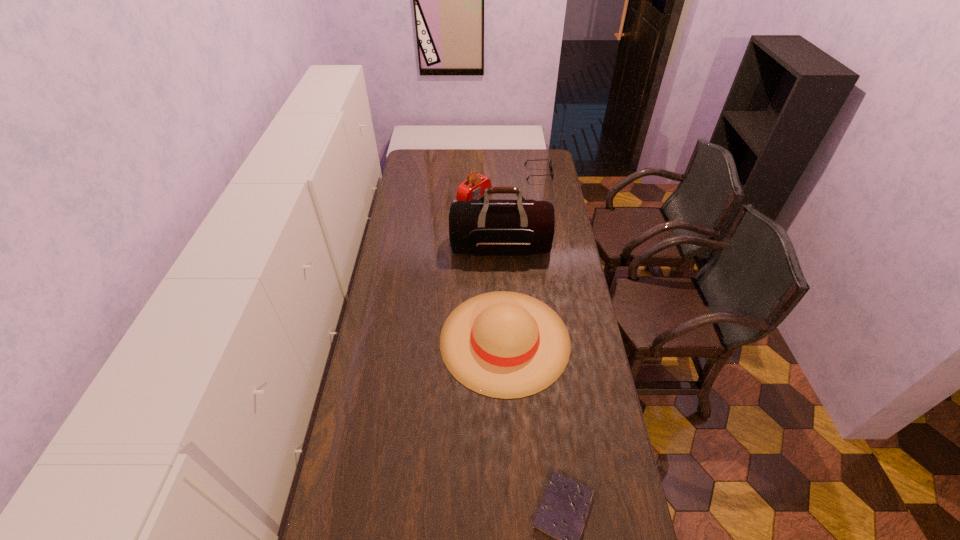
Identify the location of duffel bag that is at the right edge. The height and width of the screenshot is (540, 960). (483, 227).

Find the location of a particular element. sombrero that is at the right edge is located at coordinates (502, 344).

Where is `spectacles situated at the right edge`? This screenshot has width=960, height=540. spectacles situated at the right edge is located at coordinates (551, 168).

I want to click on object that is positioned at the far right corner, so click(x=551, y=168).

This screenshot has width=960, height=540. I want to click on blank space at the far edge of the desktop, so click(x=457, y=153).

This screenshot has width=960, height=540. Find the location of `vacant point at the left edge`. vacant point at the left edge is located at coordinates (363, 492).

Where is `vacant region at the right edge of the desktop`? Image resolution: width=960 pixels, height=540 pixels. vacant region at the right edge of the desktop is located at coordinates (600, 490).

I want to click on vacant space at the far left corner of the desktop, so click(x=411, y=159).

Where is `free spot between the spectacles and the sombrero`? free spot between the spectacles and the sombrero is located at coordinates pyautogui.click(x=521, y=256).

This screenshot has width=960, height=540. I want to click on blank region between the sombrero and the toaster, so click(490, 268).